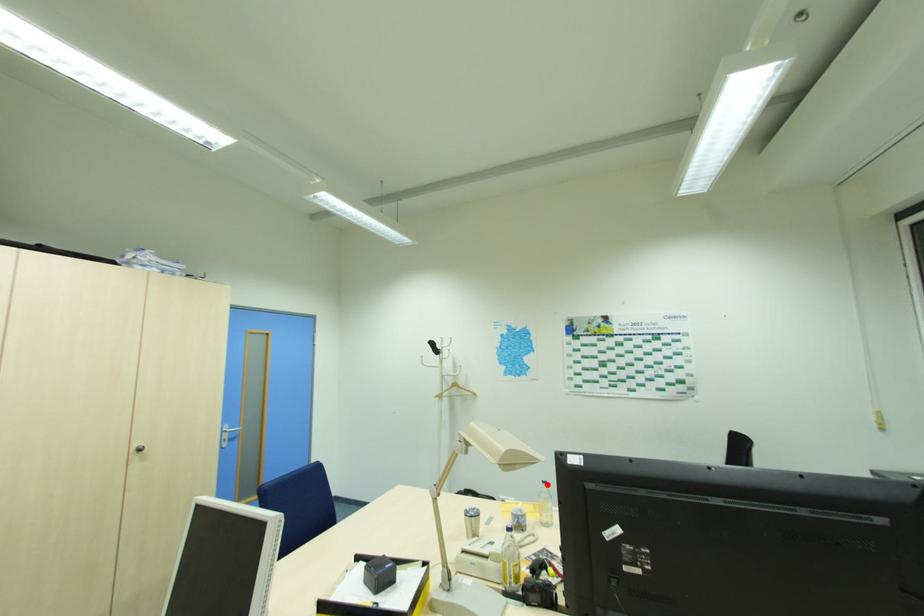
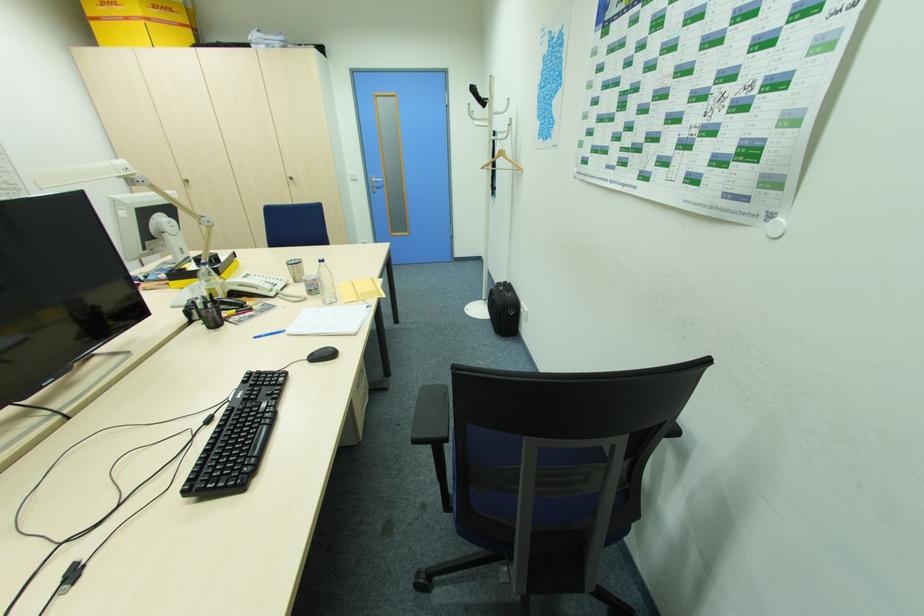
Find the pixel in the second image that matches the highlighted location in the first image.

(324, 264)